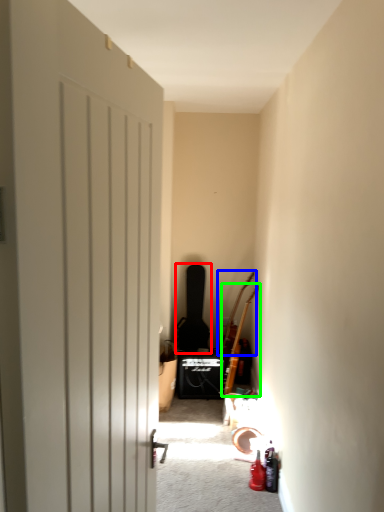
Question: Based on their relative distances, which object is farther from guitar (highlighted by a red box)? Choose from guitar (highlighted by a blue box) and guitar (highlighted by a green box).

Choices:
 (A) guitar
 (B) guitar

Answer: (B)